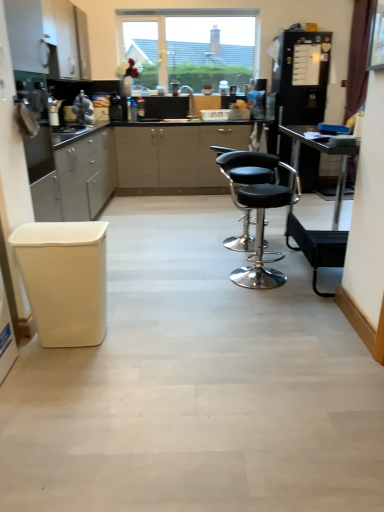
Question: Is black leather stool at center in front of or behind clear glass window at upper center in the image?

Choices:
 (A) front
 (B) behind

Answer: (A)

Question: Based on their sizes in the image, would you say black leather stool at center is bigger or smaller than clear glass window at upper center?

Choices:
 (A) big
 (B) small

Answer: (A)

Question: Considering the real-world distances, which object is closest to the metallic stainless steel oven at left, the 1th appliance when ordered from front to back?

Choices:
 (A) white matte cabinet at upper left
 (B) satin black coffee machine at upper left, acting as the fourth appliance starting from the front
 (C) black leather stool at center
 (D) black leather bar stool at right, arranged as the 2th bar stool when viewed from the front
 (E) satin silver statue at upper left, arranged as the 2th appliance when viewed from the front

Answer: (C)

Question: Which is farther from the metallic stainless steel oven at left, the 1th appliance when ordered from front to back?

Choices:
 (A) white matte cabinet at upper left
 (B) black matte refrigerator at right, which ranks as the fourth appliance in left-to-right order
 (C) satin black coffee machine at upper left, which ranks as the first appliance in back-to-front order
 (D) clear glass window at upper center
 (E) white woven bar stool at left, which is the 1th bar stool from front to back

Answer: (B)